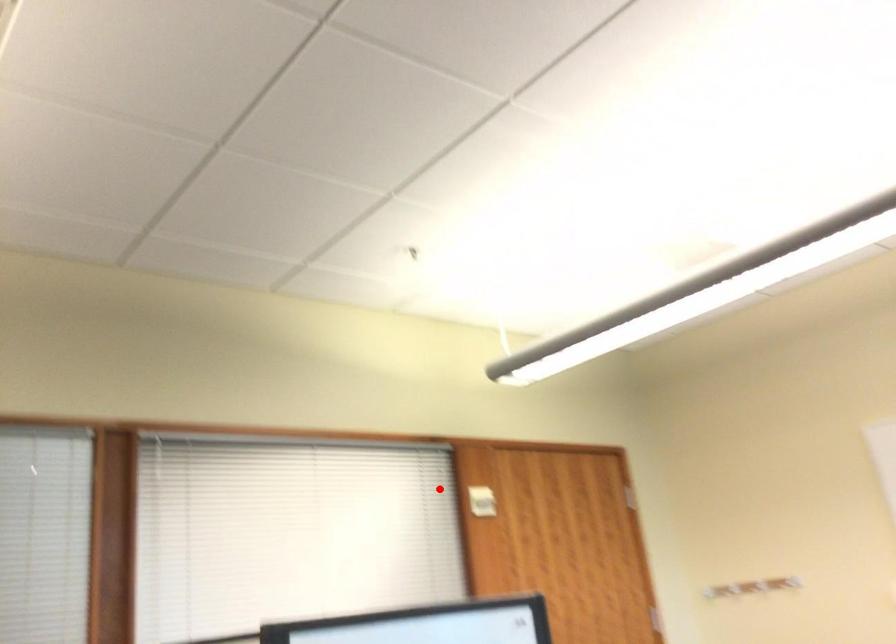
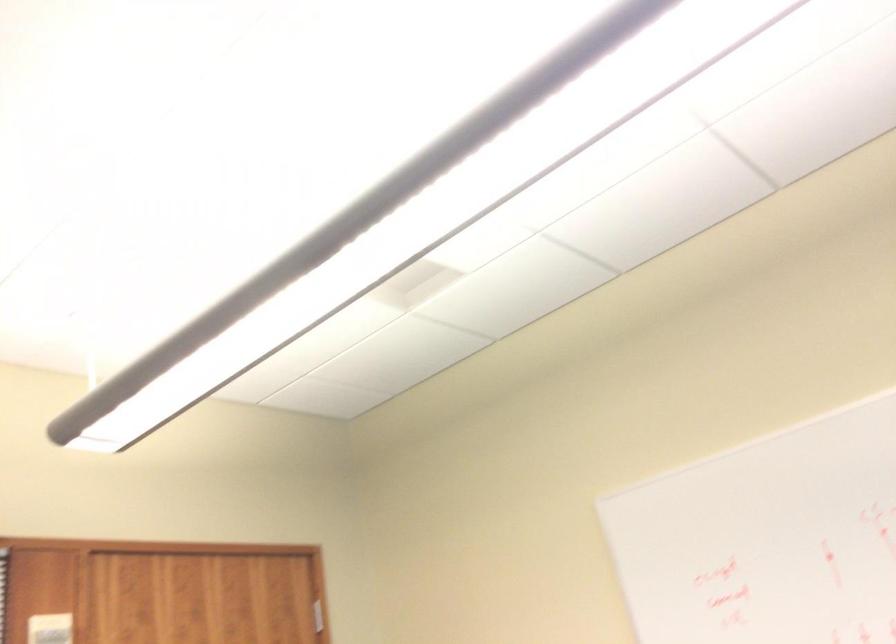
Find the pixel in the second image that matches the highlighted location in the first image.

(49, 629)